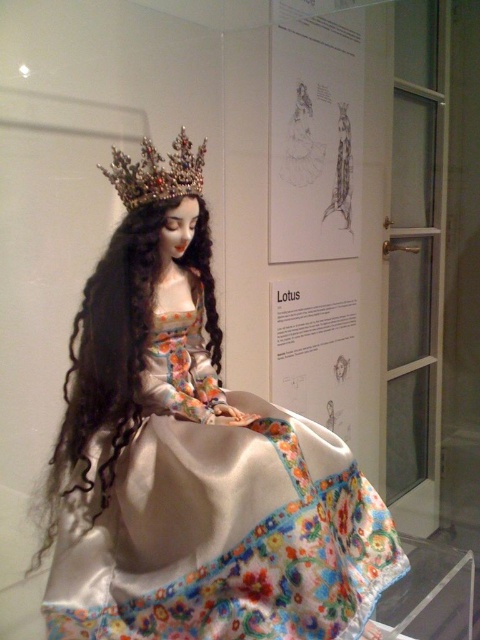
You are a visitor at the museum and notice the mannequin in the glass case. Which object is positioned higher on the mannequin, the silky brown hair at center or the sparkling gemstone crown at upper center?

The sparkling gemstone crown at upper center is positioned higher on the mannequin than the silky brown hair at center, as the crown is at the upper center and the hair is below it.

Where is the silky satin dress at center located in the image?

The silky satin dress at center is located at point (192, 458) in the image.